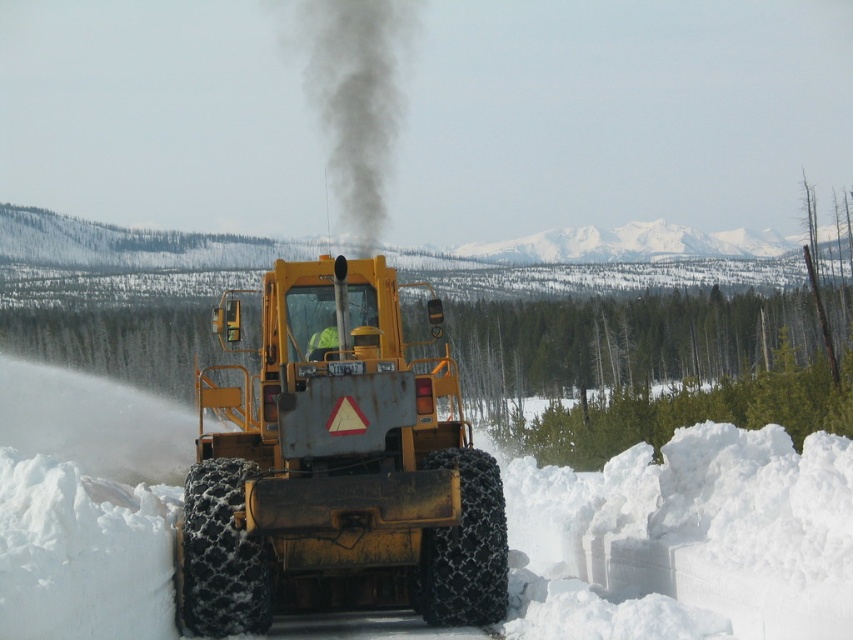
Is white powdery snow at center to the left of black smoke at center from the viewer's perspective?

Incorrect, white powdery snow at center is not on the left side of black smoke at center.

Between white powdery snow at center and black smoke at center, which one has less height?

white powdery snow at center is shorter.

In order to click on white powdery snow at center in this screenshot , I will do click(x=689, y=540).

Does yellow metallic tractor at center lie behind black smoke at center?

No, yellow metallic tractor at center is closer to the viewer.

Is point (292, 268) positioned after point (331, 22)?

No.

Describe the element at coordinates (337, 472) in the screenshot. The height and width of the screenshot is (640, 853). I see `yellow metallic tractor at center` at that location.

Find the location of a particular element. The width and height of the screenshot is (853, 640). yellow metallic tractor at center is located at coordinates (337, 472).

Who is shorter, white powdery snow at center or yellow metallic tractor at center?

yellow metallic tractor at center is shorter.

From the picture: Can you confirm if white powdery snow at center is thinner than yellow metallic tractor at center?

Incorrect, white powdery snow at center's width is not less than yellow metallic tractor at center's.

Which is in front, point (132, 515) or point (354, 372)?

Point (132, 515) is more forward.

Identify the location of white powdery snow at center. This screenshot has width=853, height=640. (689, 540).